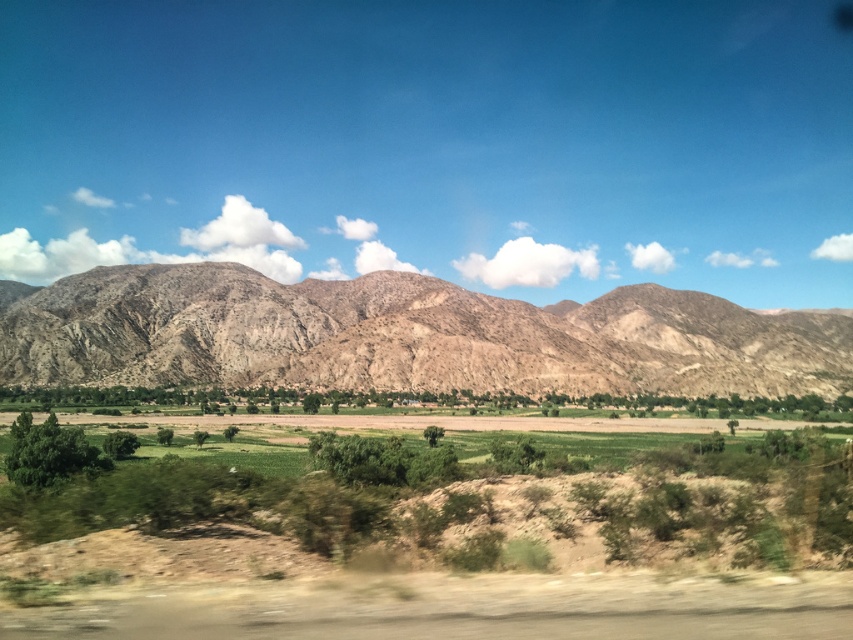
You are a landscape photographer planning to capture the green grassy field at center and the brown rocky mountain range at center in a single shot. Which of the two will occupy a larger portion of your photo?

The brown rocky mountain range at center occupies more space than the green grassy field at center, so it will take up a larger portion of the photo.

You are standing in the scenic landscape and want to take a photo of both the green grassy field at center and the brown rocky mountain range at center. Which object should you point your camera towards first to capture both in the frame?

You should point your camera towards the brown rocky mountain range at center first because the green grassy field at center is below it, allowing both to be captured in the frame when the mountain is centered.

You are standing at the edge of the green grassy field at center and want to walk towards the brown rocky mountain range at center. Which direction should you head?

You should head to the left because the green grassy field at center is to the right of the brown rocky mountain range at center, so moving left will take you towards the mountain range.